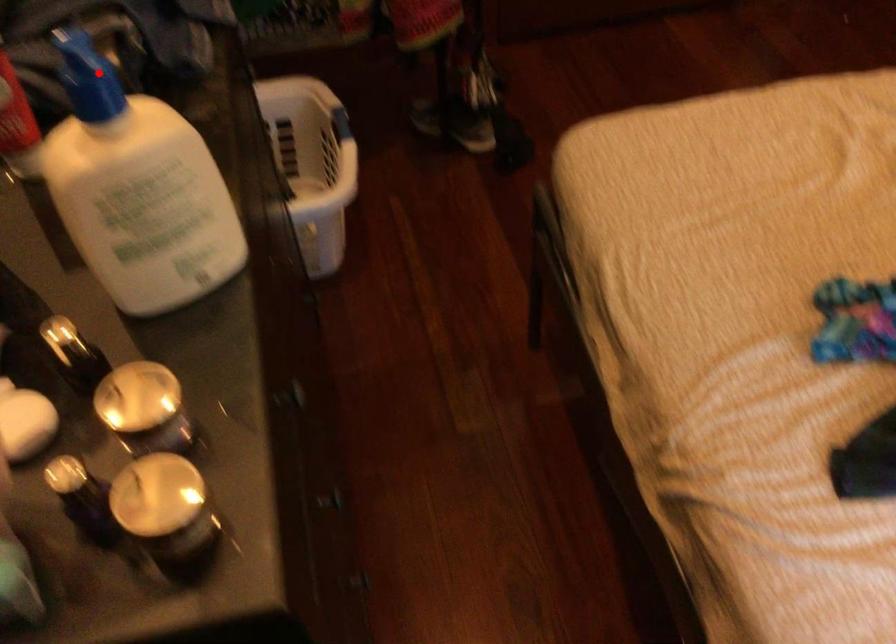
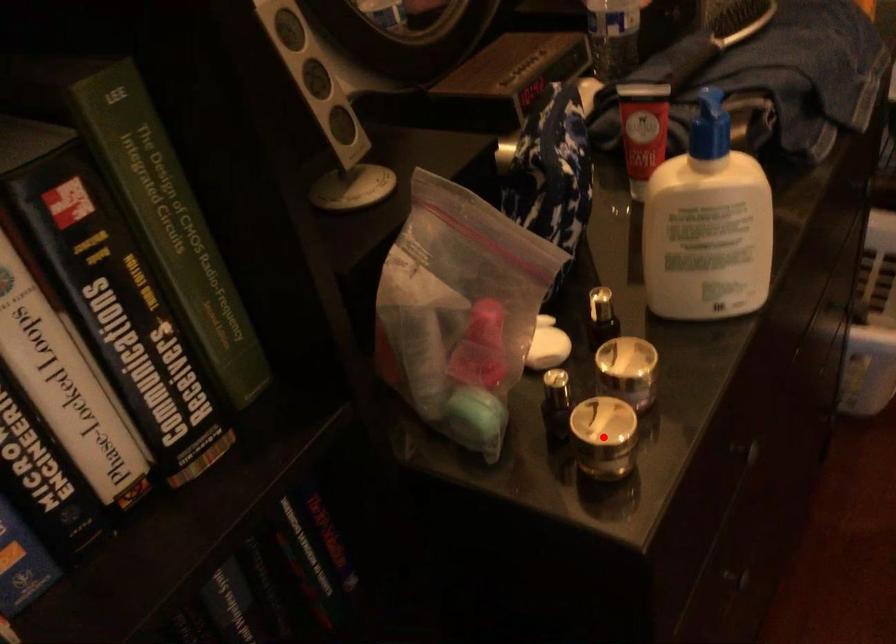
I am providing you with two images of the same scene from different viewpoints. A red point is marked on the first image and another point is marked on the second image. Do the highlighted points in image1 and image2 indicate the same real-world spot?

No